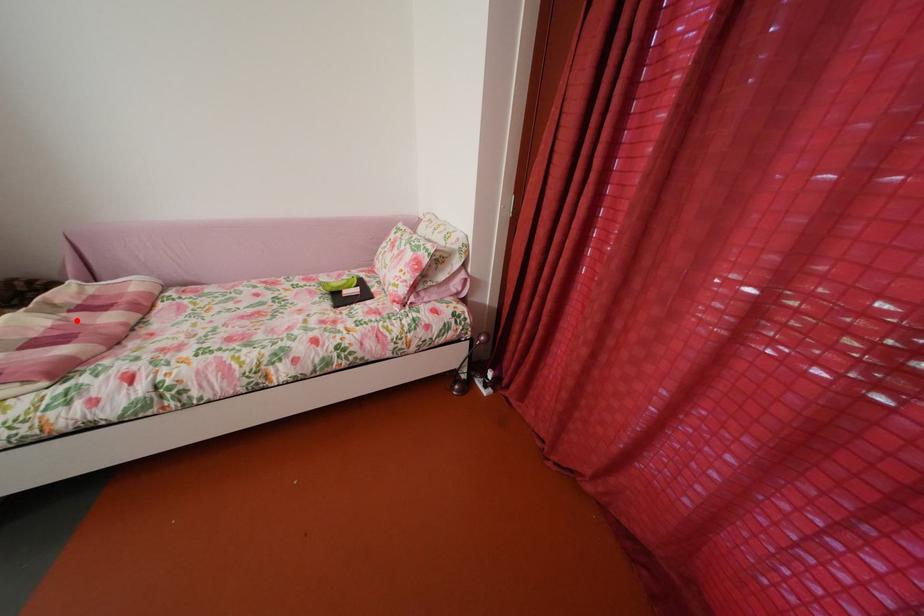
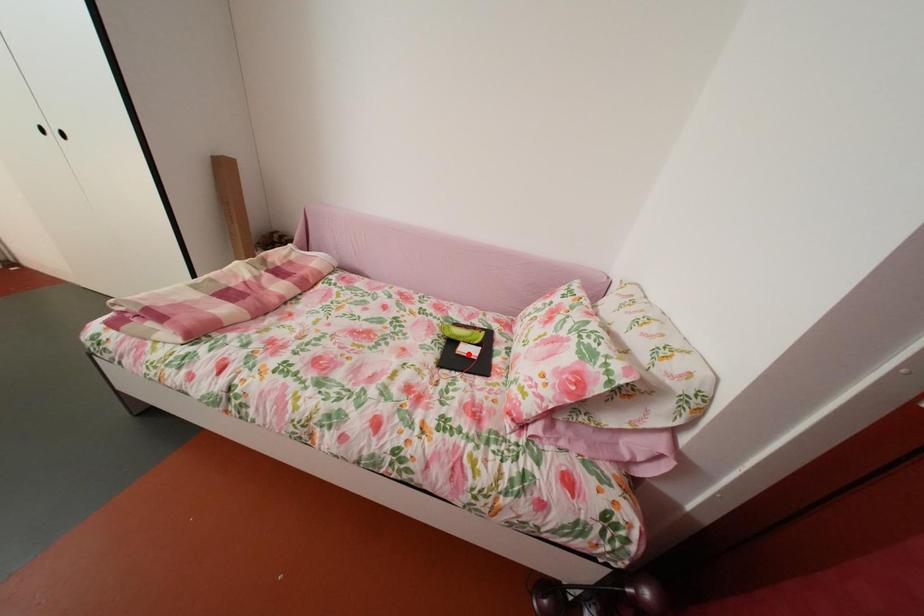
I am providing you with two images of the same scene from different viewpoints. A red point is marked on the first image and another point is marked on the second image. Is the red point in image1 aligned with the point shown in image2?

No